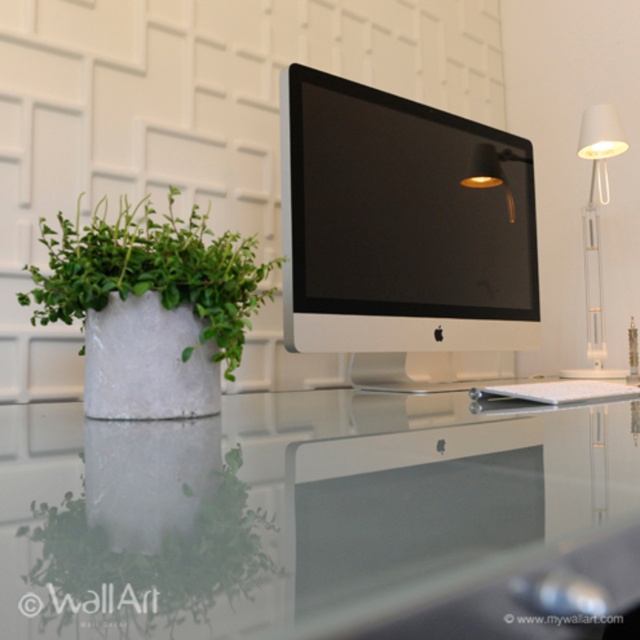
Who is positioned more to the right, green leafy plant at left or white matte desk lamp at upper right?

From the viewer's perspective, white matte desk lamp at upper right appears more on the right side.

In the scene shown: Is green leafy plant at left positioned behind white matte desk lamp at upper right?

No.

Between point (260, 532) and point (592, 362), which one is positioned in front?

Point (260, 532) is in front.

The image size is (640, 640). I want to click on green leafy plant at left, so click(147, 563).

Is transparent glass table at center to the right of white matte desk lamp at upper right from the viewer's perspective?

Incorrect, transparent glass table at center is not on the right side of white matte desk lamp at upper right.

This screenshot has width=640, height=640. What do you see at coordinates (314, 516) in the screenshot?
I see `transparent glass table at center` at bounding box center [314, 516].

Who is more forward, (81, 570) or (596, 124)?

Point (81, 570)

Locate an element on the screen. transparent glass table at center is located at coordinates (314, 516).

Between point (125, 426) and point (124, 291), which one is positioned in front?

Point (125, 426) is more forward.

Which is in front, point (106, 548) or point (236, 317)?

Point (106, 548)

This screenshot has height=640, width=640. Identify the location of transparent glass table at center. (314, 516).